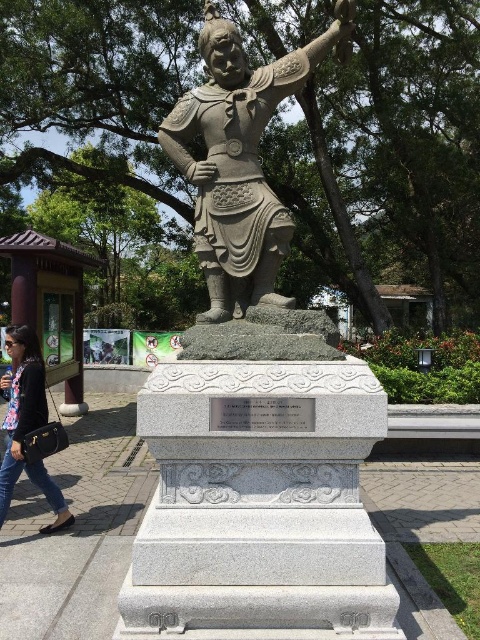
Question: Estimate the real-world distances between objects in this image. Which object is closer to the bronze statue at center?

Choices:
 (A) gray stone pavement at center
 (B) gray stone statue at center

Answer: (B)

Question: Considering the relative positions of gray stone pavement at center and denim jeans at lower left in the image provided, where is gray stone pavement at center located with respect to denim jeans at lower left?

Choices:
 (A) below
 (B) above

Answer: (A)

Question: Can you confirm if gray stone statue at center is bigger than bronze statue at center?

Choices:
 (A) no
 (B) yes

Answer: (B)

Question: Does bronze statue at center appear on the right side of denim jeans at lower left?

Choices:
 (A) no
 (B) yes

Answer: (B)

Question: Which point appears closest to the camera in this image?

Choices:
 (A) (203, 113)
 (B) (67, 467)
 (C) (43, 401)
 (D) (239, 257)

Answer: (D)

Question: Which object is closer to the camera taking this photo?

Choices:
 (A) gray stone statue at center
 (B) bronze statue at center
 (C) gray stone pavement at center
 (D) denim jeans at lower left

Answer: (A)